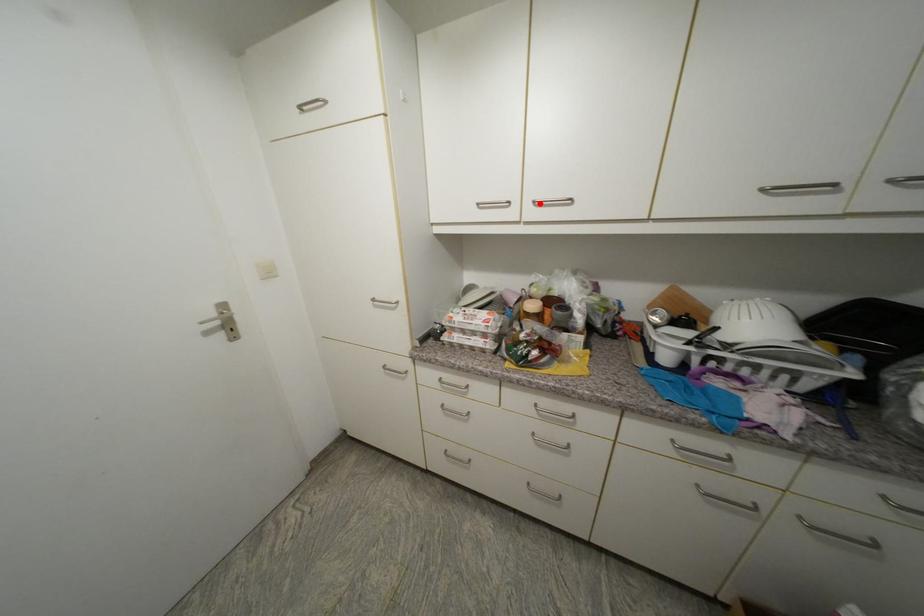
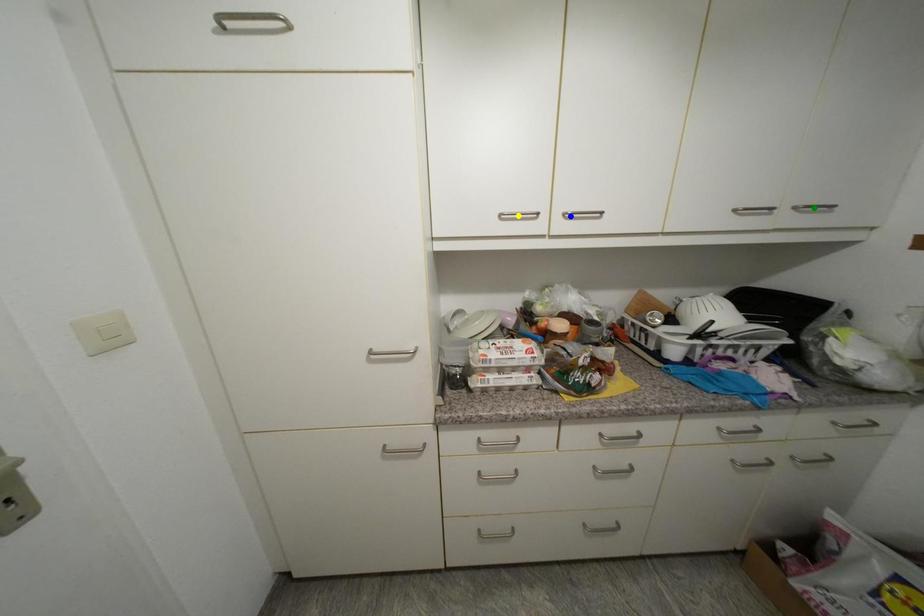
Question: I am providing you with two images of the same scene from different viewpoints. A red point is marked on the first image. You are given multiple points on the second image. Which mark in image 2 goes with the point in image 1?

Choices:
 (A) yellow point
 (B) blue point
 (C) green point

Answer: (B)